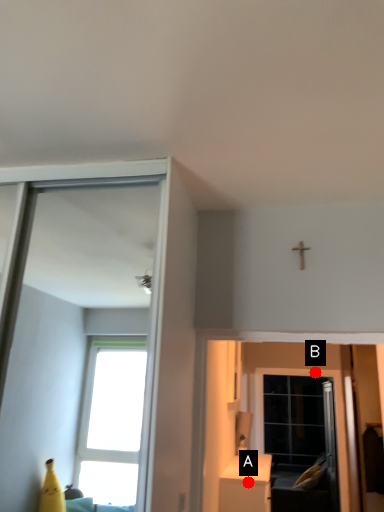
Question: Two points are circled on the image, labeled by A and B beside each circle. Which point is closer to the camera?

Choices:
 (A) A is closer
 (B) B is closer

Answer: (A)